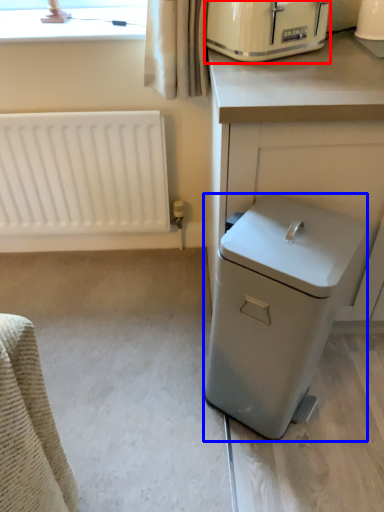
Question: Which object is further to the camera taking this photo, home appliance (highlighted by a red box) or dish washer (highlighted by a blue box)?

Choices:
 (A) home appliance
 (B) dish washer

Answer: (A)